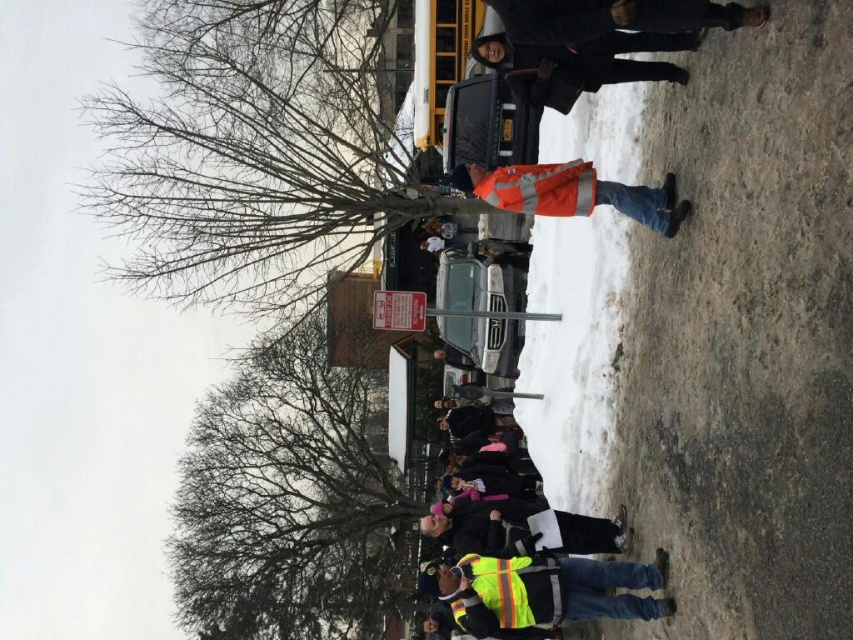
Question: Among these points, which one is farthest from the camera?

Choices:
 (A) (662, 36)
 (B) (650, 586)
 (C) (509, 288)

Answer: (C)

Question: Is reflective orange vest at upper center below metallic silver car at center?

Choices:
 (A) yes
 (B) no

Answer: (B)

Question: Based on their relative distances, which object is farther from the metallic reflective lift at center?

Choices:
 (A) metallic silver car at center
 (B) reflective yellow safety vest at center
 (C) reflective orange vest at upper center

Answer: (C)

Question: Does metallic silver car at center appear on the left side of reflective yellow safety vest at lower center?

Choices:
 (A) yes
 (B) no

Answer: (B)

Question: Is reflective orange vest at center to the left of metallic silver car at center from the viewer's perspective?

Choices:
 (A) no
 (B) yes

Answer: (A)

Question: Based on their relative distances, which object is farther from the reflective orange vest at center?

Choices:
 (A) reflective orange vest at upper center
 (B) reflective yellow safety vest at center
 (C) metallic silver car at center

Answer: (B)